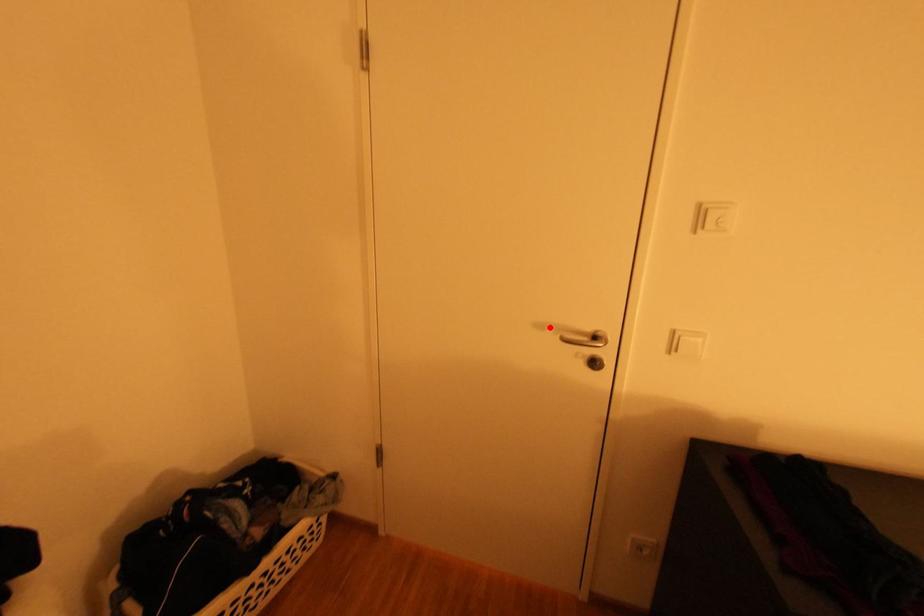
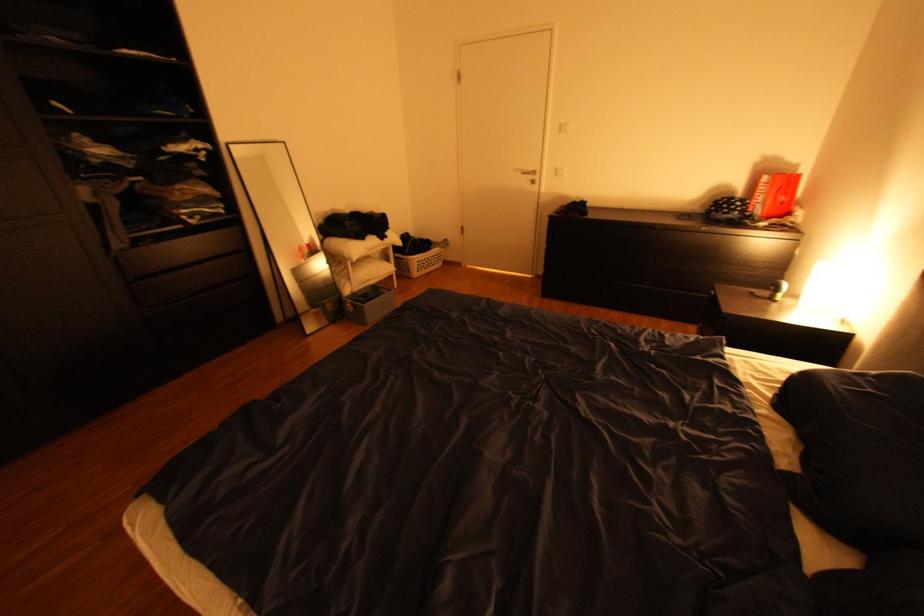
Question: I am providing you with two images of the same scene from different viewpoints. Image1 has a red point marked. In image2, the corresponding 3D location appears at what relative position? Reply with the corresponding letter.

Choices:
 (A) Closer
 (B) Farther

Answer: (A)